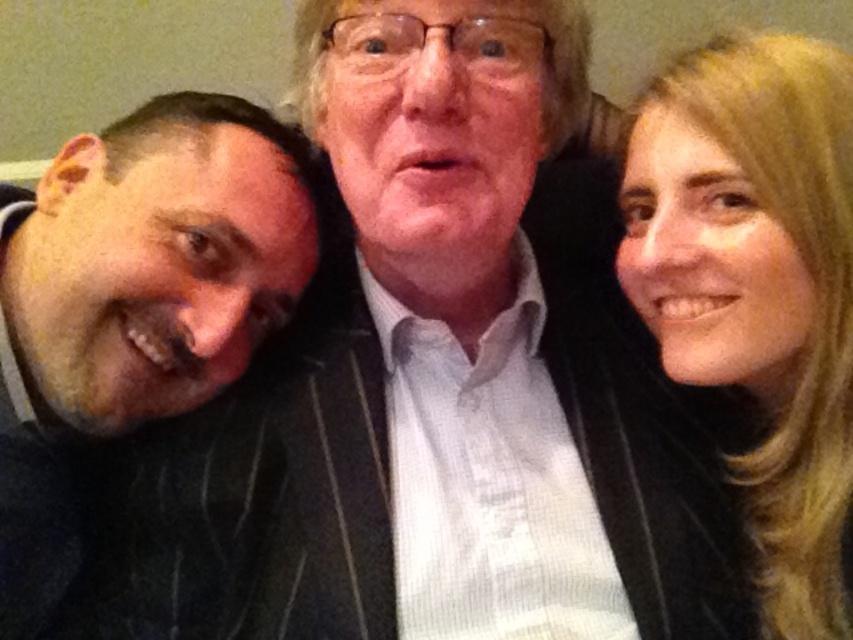
Question: Is dark pinstripe suit at left bigger than blonde hair at upper right?

Choices:
 (A) no
 (B) yes

Answer: (B)

Question: Does dark pinstripe suit at left come in front of blonde hair at upper right?

Choices:
 (A) no
 (B) yes

Answer: (A)

Question: Is dark pinstripe suit at left positioned behind blonde hair at upper right?

Choices:
 (A) no
 (B) yes

Answer: (B)

Question: Which point is closer to the camera taking this photo?

Choices:
 (A) (625, 284)
 (B) (173, 321)

Answer: (B)